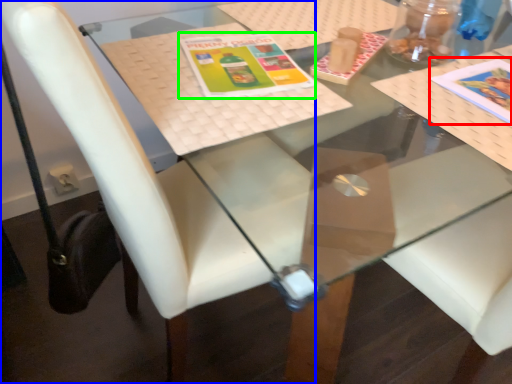
Question: Which object is the closest to the book cover (highlighted by a red box)? Choose among these: chair (highlighted by a blue box) or book cover (highlighted by a green box).

Choices:
 (A) chair
 (B) book cover

Answer: (B)